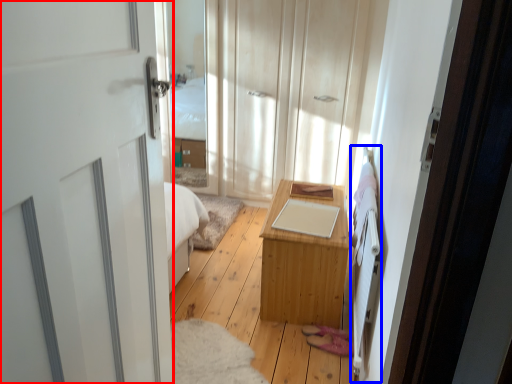
Question: Which object is closer to the camera taking this photo, door (highlighted by a red box) or bed frame (highlighted by a blue box)?

Choices:
 (A) door
 (B) bed frame

Answer: (A)